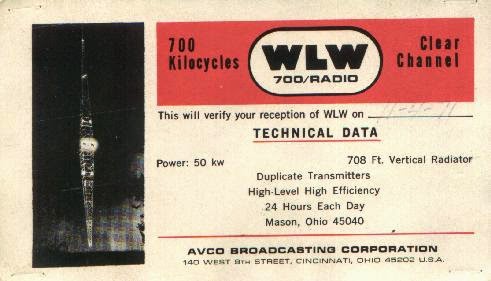
The width and height of the screenshot is (491, 281). I want to click on radiator, so click(80, 171), click(443, 163).